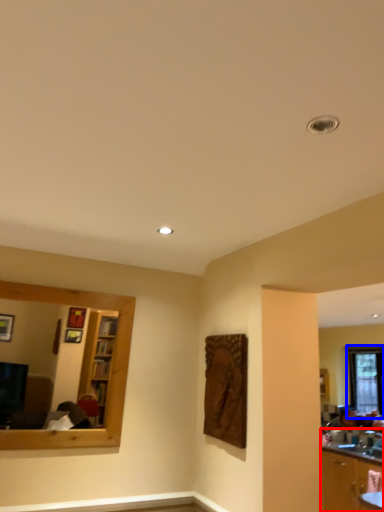
Question: Which object appears farthest to the camera in this image, cabinetry (highlighted by a red box) or window (highlighted by a blue box)?

Choices:
 (A) cabinetry
 (B) window

Answer: (B)